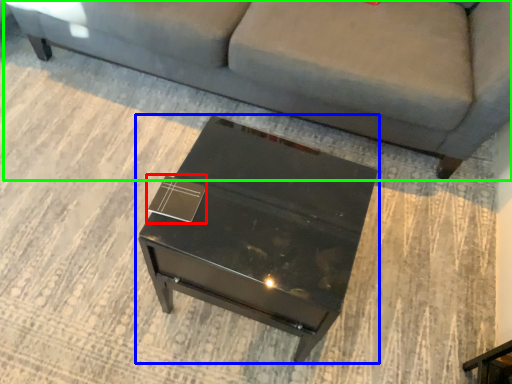
Question: Which object is the farthest from square (highlighted by a red box)? Choose among these: table (highlighted by a blue box) or studio couch (highlighted by a green box).

Choices:
 (A) table
 (B) studio couch

Answer: (B)